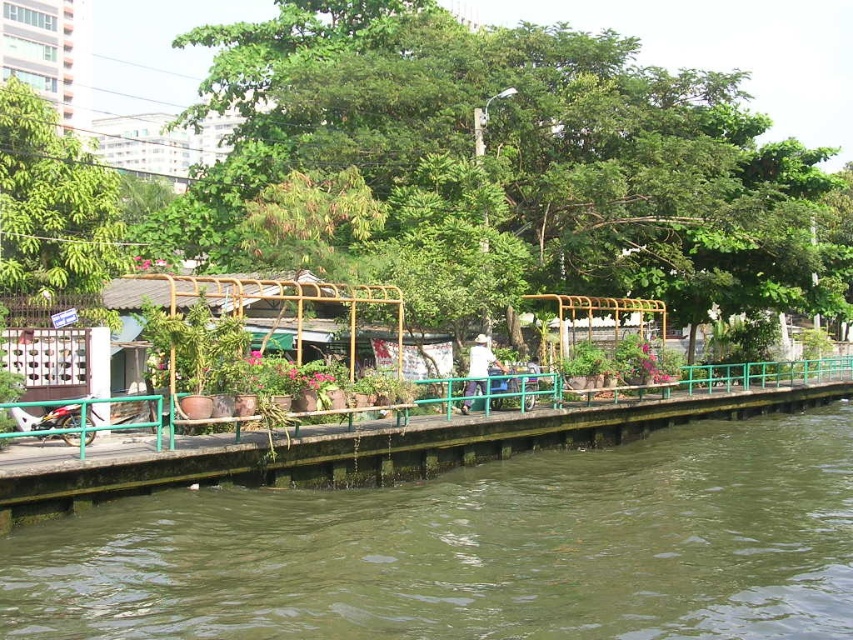
Does green wooden dock at center appear on the left side of green leafy tree at upper left?

Incorrect, green wooden dock at center is not on the left side of green leafy tree at upper left.

Does green wooden dock at center appear over green leafy tree at upper left?

Incorrect, green wooden dock at center is not positioned above green leafy tree at upper left.

Where is `green wooden dock at center`? This screenshot has width=853, height=640. green wooden dock at center is located at coordinates (421, 442).

Can you confirm if green leafy tree at center is taller than white fabric at center?

Yes, green leafy tree at center is taller than white fabric at center.

The height and width of the screenshot is (640, 853). I want to click on green leafy tree at center, so (x=521, y=150).

Image resolution: width=853 pixels, height=640 pixels. Find the location of `green leafy tree at center`. green leafy tree at center is located at coordinates point(521,150).

Which is behind, point (308, 68) or point (488, 440)?

Positioned behind is point (308, 68).

Where is `green leafy tree at center`? green leafy tree at center is located at coordinates (521, 150).